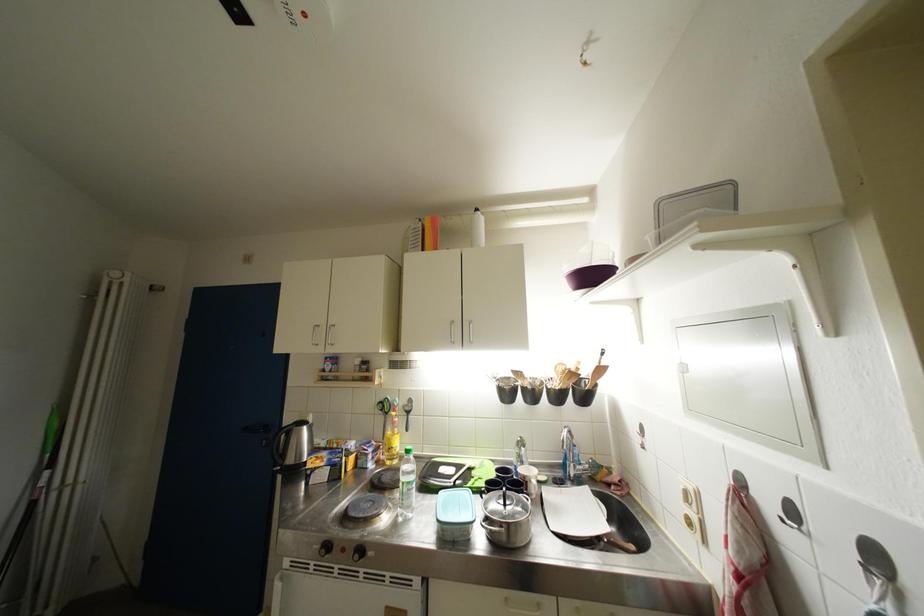
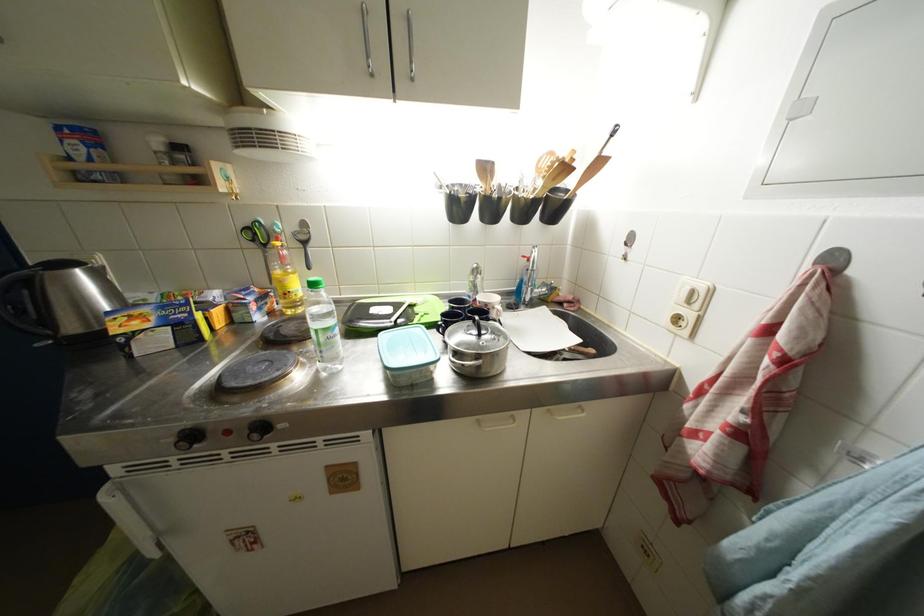
Find the pixel in the second image that matches point (393, 418) in the first image.

(272, 249)